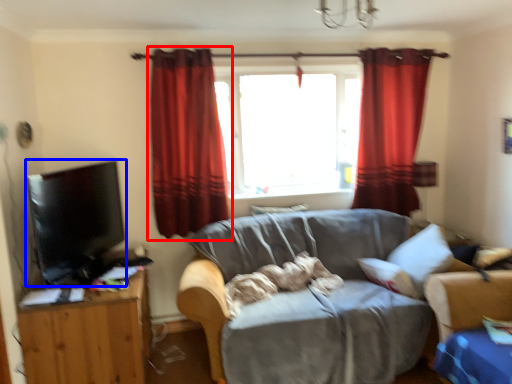
Question: Which object is further to the camera taking this photo, curtain (highlighted by a red box) or flat (highlighted by a blue box)?

Choices:
 (A) curtain
 (B) flat

Answer: (A)